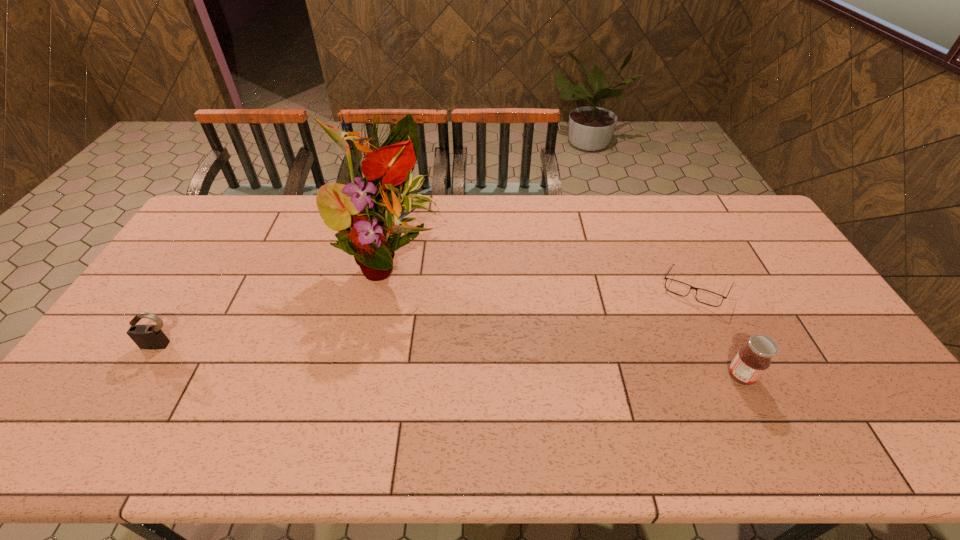
Where is `free space located on the front-facing side of the bouquet`? free space located on the front-facing side of the bouquet is located at coordinates (390, 316).

The image size is (960, 540). Find the location of `vacant region located with the lenses facing outward on the shortest object`. vacant region located with the lenses facing outward on the shortest object is located at coordinates (641, 312).

Image resolution: width=960 pixels, height=540 pixels. Find the location of `vacant space situated 0.220m with the lenses facing outward on the shortest object`. vacant space situated 0.220m with the lenses facing outward on the shortest object is located at coordinates (611, 325).

In order to click on vacant space situated with the lenses facing outward on the shortest object in this screenshot , I will do `click(611, 325)`.

I want to click on object that is at the far edge, so click(x=367, y=213).

You are a GUI agent. You are given a task and a screenshot of the screen. Output one action in this format:
    pyautogui.click(x=<x>, y=<y>)
    Task: Click on the object that is at the near edge
    
    Given the screenshot: What is the action you would take?
    pyautogui.click(x=750, y=363)

This screenshot has width=960, height=540. What are the coordinates of `object that is at the left edge` in the screenshot? It's located at (151, 337).

I want to click on free point at the far edge, so click(564, 223).

Locate an element on the screen. This screenshot has width=960, height=540. vacant region at the near edge of the desktop is located at coordinates (452, 384).

You are a GUI agent. You are given a task and a screenshot of the screen. Output one action in this format:
    pyautogui.click(x=<x>, y=<y>)
    Task: Click on the vacant space at the left edge of the desktop
    
    Given the screenshot: What is the action you would take?
    pyautogui.click(x=161, y=287)